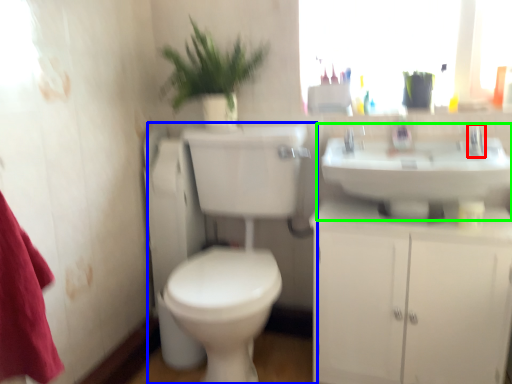
Question: Estimate the real-world distances between objects in this image. Which object is closer to tap (highlighted by a red box), toilet (highlighted by a blue box) or sink (highlighted by a green box)?

Choices:
 (A) toilet
 (B) sink

Answer: (B)